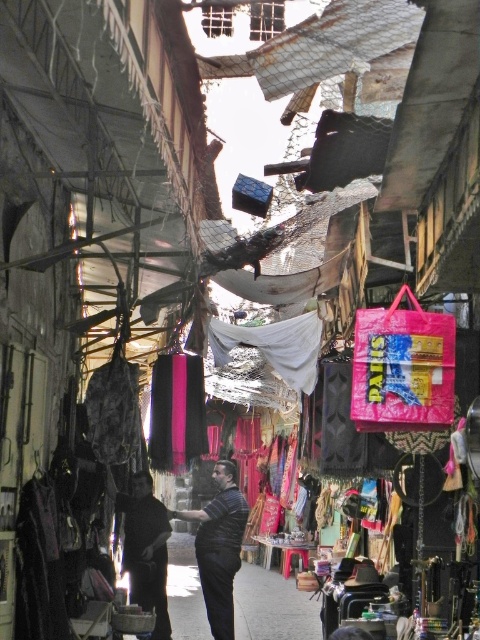
Does point (204, 518) come behind point (126, 556)?

No, it is in front of (126, 556).

Can you confirm if striped fabric shirt at center is thinner than dark fabric bag at center?

No, striped fabric shirt at center is not thinner than dark fabric bag at center.

Is point (183, 513) positioned before point (146, 572)?

Yes.

Where is `striped fabric shirt at center`? striped fabric shirt at center is located at coordinates (218, 547).